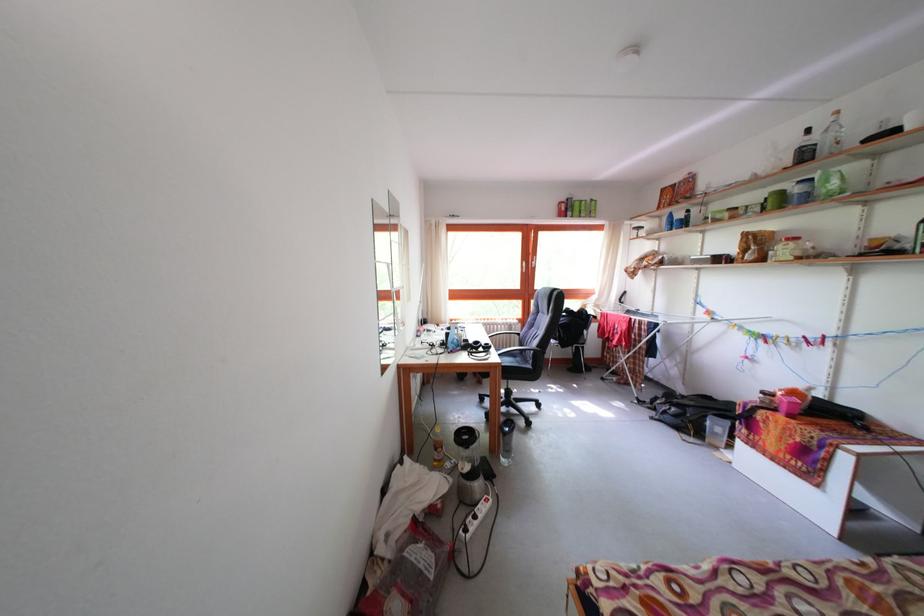
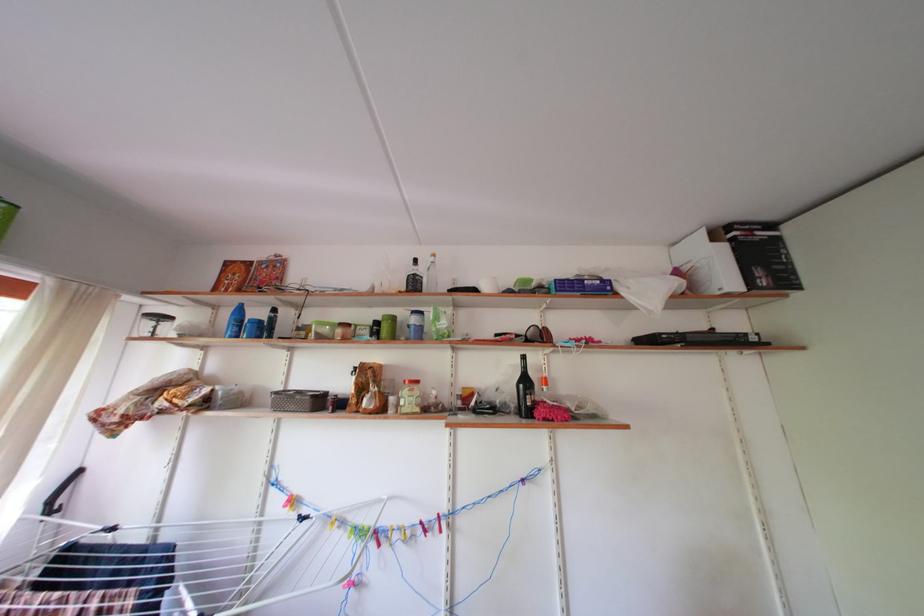
The point at (823, 144) is marked in the first image. Where is the corresponding point in the second image?

(430, 276)